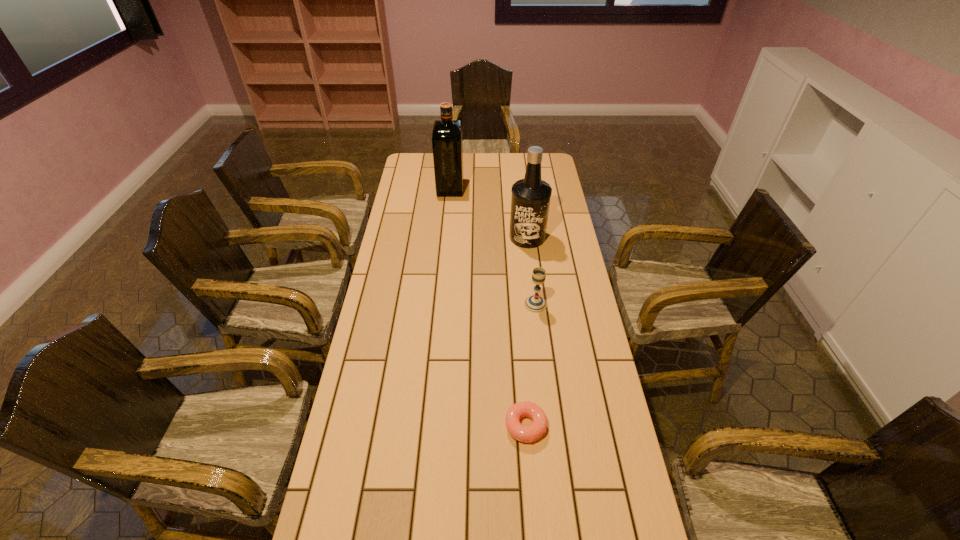
You are a GUI agent. You are given a task and a screenshot of the screen. Output one action in this format:
    pyautogui.click(x=<x>, y=<y>)
    Task: Click on the farthest object
    
    Given the screenshot: What is the action you would take?
    pyautogui.click(x=447, y=144)

The height and width of the screenshot is (540, 960). What are the coordinates of `the leftmost object` in the screenshot? It's located at (447, 144).

The width and height of the screenshot is (960, 540). What are the coordinates of `the nearer liquor` in the screenshot? It's located at click(x=530, y=201).

The image size is (960, 540). I want to click on the second farthest object, so click(x=530, y=201).

The image size is (960, 540). Find the location of `the third tallest object`. the third tallest object is located at coordinates (535, 303).

Locate an element on the screen. This screenshot has height=540, width=960. the third farthest object is located at coordinates coord(535,303).

You are a GUI agent. You are given a task and a screenshot of the screen. Output one action in this format:
    pyautogui.click(x=<x>, y=<y>)
    Task: Click on the nearest object
    This screenshot has height=540, width=960.
    Given the screenshot: What is the action you would take?
    pyautogui.click(x=533, y=432)

Find the location of a particular element. This screenshot has height=540, width=960. the shortest object is located at coordinates point(533,432).

Image resolution: width=960 pixels, height=540 pixels. I want to click on vacant space positioned on the front label of the leftmost object, so click(x=506, y=188).

Locate an element on the screen. This screenshot has height=540, width=960. vacant region located 0.100m on the front label of the nearer liquor is located at coordinates (531, 266).